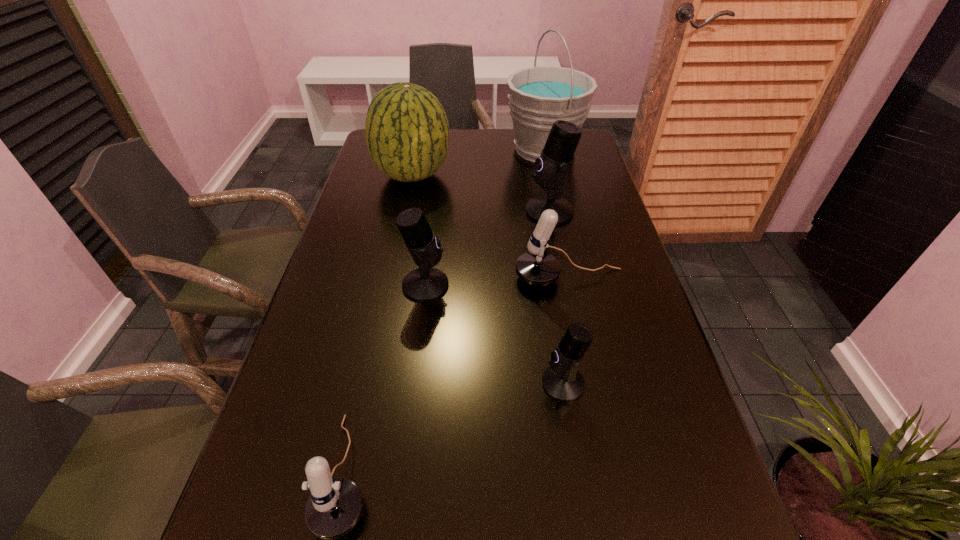
At what (x,y) coordinates should I click in order to perform the action: click on vacant space situated on the stand of the nearest black microphone. Please return your answer as a coordinate pair (x, y). Looking at the image, I should click on (451, 383).

You are a GUI agent. You are given a task and a screenshot of the screen. Output one action in this format:
    pyautogui.click(x=<x>, y=<y>)
    Task: Click on the bucket positioned at the far edge
    
    Given the screenshot: What is the action you would take?
    pyautogui.click(x=538, y=96)

The image size is (960, 540). Identify the location of watermelon that is at the far edge. coord(407,133).

I want to click on object that is at the left edge, so click(x=407, y=133).

Find the location of a particular element. This screenshot has height=540, width=960. bucket present at the right edge is located at coordinates (538, 96).

Image resolution: width=960 pixels, height=540 pixels. In order to click on object positioned at the far left corner in this screenshot , I will do `click(407, 133)`.

Where is `object at the far right corner`? object at the far right corner is located at coordinates (538, 96).

In the image, there is a desktop. Where is `vacant space at the far edge`? Image resolution: width=960 pixels, height=540 pixels. vacant space at the far edge is located at coordinates (496, 148).

Find the location of a particular element. vacant space at the left edge of the desktop is located at coordinates (345, 280).

I want to click on vacant space at the right edge of the desktop, so click(x=601, y=362).